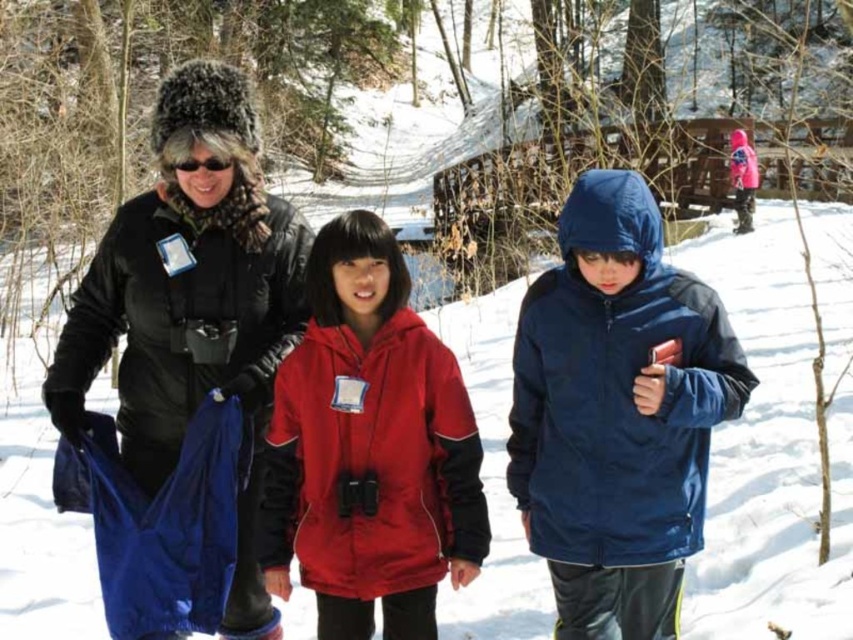
Question: Does navy blue softshell jacket at center have a smaller size compared to matte nylon jacket at center?

Choices:
 (A) yes
 (B) no

Answer: (B)

Question: Is navy blue softshell jacket at center smaller than matte nylon jacket at center?

Choices:
 (A) yes
 (B) no

Answer: (B)

Question: Which of the following is the farthest from the observer?

Choices:
 (A) (316, 518)
 (B) (645, 380)
 (C) (148, 200)

Answer: (C)

Question: Is navy blue softshell jacket at center in front of black leather jacket at left?

Choices:
 (A) yes
 (B) no

Answer: (A)

Question: Which point is farther from the camera taking this photo?

Choices:
 (A) (631, 480)
 (B) (163, 344)

Answer: (B)

Question: Which object appears farthest from the camera in this image?

Choices:
 (A) black leather jacket at left
 (B) matte nylon jacket at center
 (C) navy blue softshell jacket at center

Answer: (A)